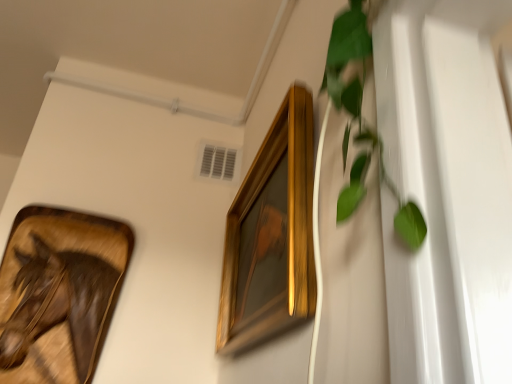
Question: From the image's perspective, is wooden frame at left, positioned as the 2th picture frame in right-to-left order, on green leafy plant at right?

Choices:
 (A) yes
 (B) no

Answer: (B)

Question: From the image's perspective, does wooden frame at left, positioned as the 2th picture frame in right-to-left order, appear lower than green leafy plant at right?

Choices:
 (A) yes
 (B) no

Answer: (A)

Question: Does wooden frame at left, positioned as the 2th picture frame in right-to-left order, have a lesser width compared to green leafy plant at right?

Choices:
 (A) yes
 (B) no

Answer: (B)

Question: Is wooden frame at left, which appears as the first picture frame when viewed from the left, located outside green leafy plant at right?

Choices:
 (A) no
 (B) yes

Answer: (B)

Question: Is wooden frame at left, which appears as the first picture frame when viewed from the left, next to green leafy plant at right and touching it?

Choices:
 (A) no
 (B) yes

Answer: (A)

Question: From their relative heights in the image, would you say green leafy plant at right is taller or shorter than gold wooden picture frame at upper center, arranged as the first picture frame when viewed from the right?

Choices:
 (A) short
 (B) tall

Answer: (A)

Question: From a real-world perspective, is green leafy plant at right positioned above or below gold wooden picture frame at upper center, arranged as the first picture frame when viewed from the right?

Choices:
 (A) below
 (B) above

Answer: (B)

Question: Is green leafy plant at right wider or thinner than gold wooden picture frame at upper center, arranged as the first picture frame when viewed from the right?

Choices:
 (A) thin
 (B) wide

Answer: (A)

Question: Is green leafy plant at right inside the boundaries of gold wooden picture frame at upper center, arranged as the first picture frame when viewed from the right, or outside?

Choices:
 (A) outside
 (B) inside

Answer: (A)

Question: Is point (66, 291) positioned closer to the camera than point (274, 289)?

Choices:
 (A) farther
 (B) closer

Answer: (A)

Question: Is wooden frame at left, which appears as the first picture frame when viewed from the left, bigger or smaller than gold wooden picture frame at upper center, arranged as the first picture frame when viewed from the right?

Choices:
 (A) big
 (B) small

Answer: (B)

Question: Considering their positions, is wooden frame at left, which appears as the first picture frame when viewed from the left, located in front of or behind gold wooden picture frame at upper center, arranged as the first picture frame when viewed from the right?

Choices:
 (A) behind
 (B) front

Answer: (A)

Question: From the image's perspective, is wooden frame at left, positioned as the 2th picture frame in right-to-left order, above or below gold wooden picture frame at upper center, arranged as the first picture frame when viewed from the right?

Choices:
 (A) below
 (B) above

Answer: (A)

Question: From the image's perspective, is green leafy plant at right above or below wooden frame at left, positioned as the 2th picture frame in right-to-left order?

Choices:
 (A) above
 (B) below

Answer: (A)

Question: Considering the relative positions of green leafy plant at right and wooden frame at left, positioned as the 2th picture frame in right-to-left order, in the image provided, is green leafy plant at right to the left or to the right of wooden frame at left, positioned as the 2th picture frame in right-to-left order,?

Choices:
 (A) right
 (B) left

Answer: (A)